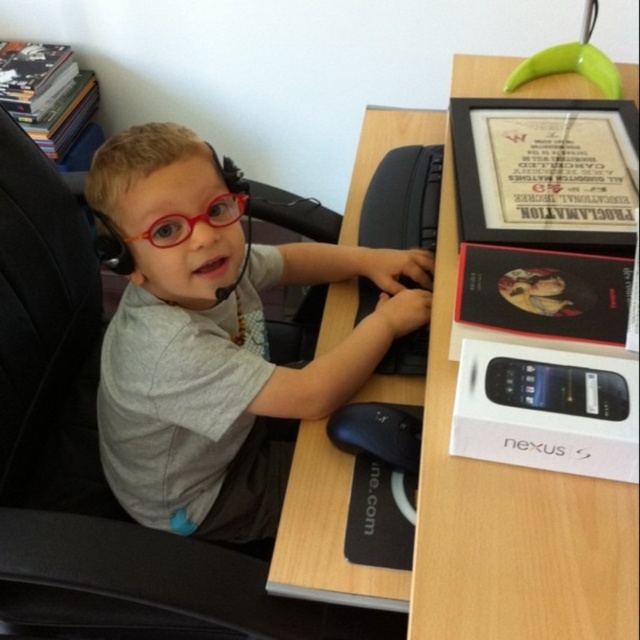
Question: Which object appears closest to the camera in this image?

Choices:
 (A) matte gray shirt at center
 (B) black textured keyboard at center
 (C) wooden at center
 (D) red plastic glasses at center

Answer: (C)

Question: Which point is closer to the camera?

Choices:
 (A) black textured keyboard at center
 (B) wooden at center
 (C) matte gray shirt at center
 (D) red plastic glasses at center

Answer: (B)

Question: Can you confirm if wooden at center is bigger than black textured keyboard at center?

Choices:
 (A) yes
 (B) no

Answer: (A)

Question: Can you confirm if matte gray shirt at center is smaller than black textured keyboard at center?

Choices:
 (A) yes
 (B) no

Answer: (B)

Question: Which point is closer to the camera?

Choices:
 (A) (337, 294)
 (B) (228, 424)

Answer: (B)

Question: Is wooden at center to the left of black textured keyboard at center from the viewer's perspective?

Choices:
 (A) no
 (B) yes

Answer: (A)